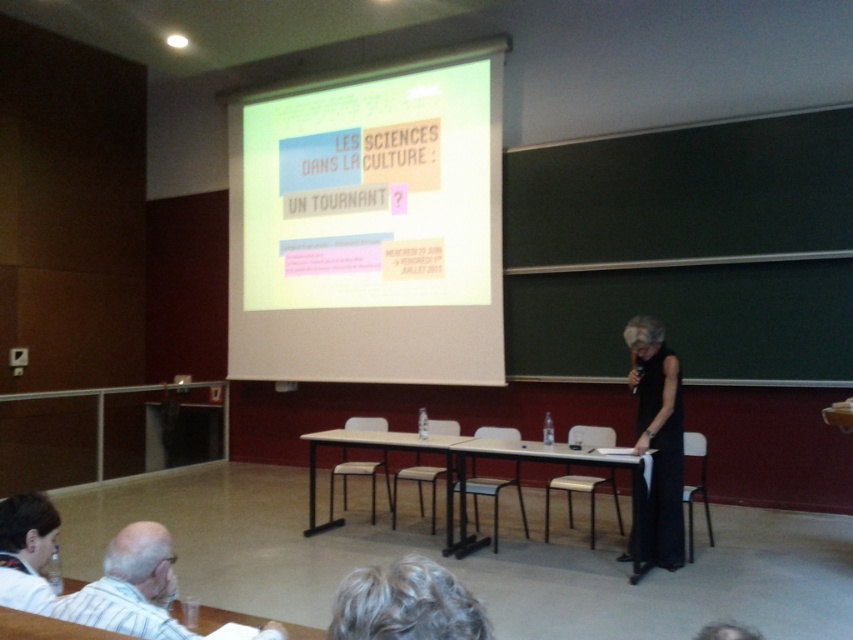
Can you confirm if white striped shirt at lower left is smaller than light brown wood table at center?

Indeed, white striped shirt at lower left has a smaller size compared to light brown wood table at center.

Between white striped shirt at lower left and light brown wood table at center, which one has more height?

Standing taller between the two is light brown wood table at center.

Is point (135, 522) less distant than point (463, 438)?

Yes, it is.

Locate an element on the screen. Image resolution: width=853 pixels, height=640 pixels. white striped shirt at lower left is located at coordinates (131, 588).

Is white striped shirt at lower left in front of wooden table at center?

Yes.

Is white striped shirt at lower left smaller than wooden table at center?

Actually, white striped shirt at lower left might be larger than wooden table at center.

Does point (115, 628) come farther from viewer compared to point (839, 412)?

No, it is not.

The image size is (853, 640). In order to click on white striped shirt at lower left in this screenshot , I will do `click(131, 588)`.

Who is more forward, (457, 456) or (849, 401)?

Point (457, 456)

Which is below, light brown wooden table at center or wooden table at center?

light brown wooden table at center

Where is `light brown wooden table at center`? This screenshot has height=640, width=853. light brown wooden table at center is located at coordinates (531, 461).

Identify the location of light brown wooden table at center. (531, 461).